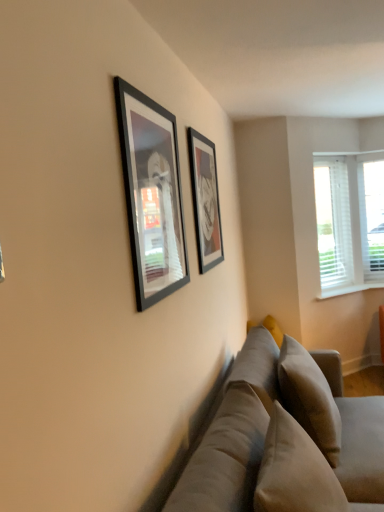
Question: In the image, is soft beige pillow at lower right on the left side or the right side of matte black picture frame at center, the 2th picture frame positioned from the front?

Choices:
 (A) left
 (B) right

Answer: (B)

Question: Is soft beige pillow at lower right taller or shorter than matte black picture frame at center, the 2th picture frame positioned from the front?

Choices:
 (A) short
 (B) tall

Answer: (A)

Question: Based on their relative distances, which object is nearer to the white plastic window sill at right?

Choices:
 (A) white plastic blinds at right
 (B) matte black picture frame at center, arranged as the 1th picture frame when viewed from the right
 (C) matte black picture frame at upper center, the 2th picture frame from the right
 (D) soft beige pillow at lower right
 (E) soft beige fabric couch at lower right

Answer: (A)

Question: Based on their relative distances, which object is farther from the white plastic window sill at right?

Choices:
 (A) soft beige fabric couch at lower right
 (B) matte black picture frame at upper center, which appears as the first picture frame when viewed from the front
 (C) matte black picture frame at center, which is counted as the first picture frame, starting from the back
 (D) soft beige pillow at lower right
 (E) white plastic blinds at right

Answer: (B)